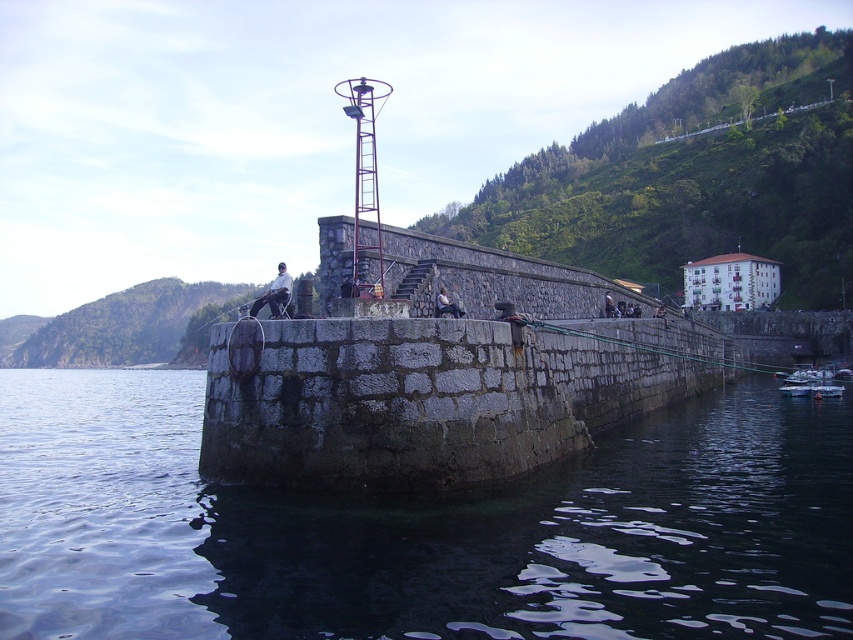
Between dark blue water at lower left and white fabric at center, which one is positioned higher?

Positioned higher is white fabric at center.

Who is more forward, (701, 435) or (445, 292)?

Point (445, 292) is more forward.

Image resolution: width=853 pixels, height=640 pixels. Find the location of `dark blue water at lower left`. dark blue water at lower left is located at coordinates (421, 529).

Which is above, dark gray fabric jacket at center or white fabric at center?

dark gray fabric jacket at center is higher up.

How far apart are dark gray fabric jacket at center and white fabric at center?

They are 9.02 meters apart.

Is point (277, 292) in front of point (445, 300)?

That is True.

Identify the location of dark gray fabric jacket at center. This screenshot has height=640, width=853. (274, 292).

Does point (86, 412) come behind point (607, 294)?

Yes, it is.

Can you confirm if dark blue water at lower left is thinner than dark gray stone person at center?

No.

This screenshot has height=640, width=853. What do you see at coordinates (421, 529) in the screenshot?
I see `dark blue water at lower left` at bounding box center [421, 529].

This screenshot has width=853, height=640. In order to click on dark blue water at lower left in this screenshot , I will do `click(421, 529)`.